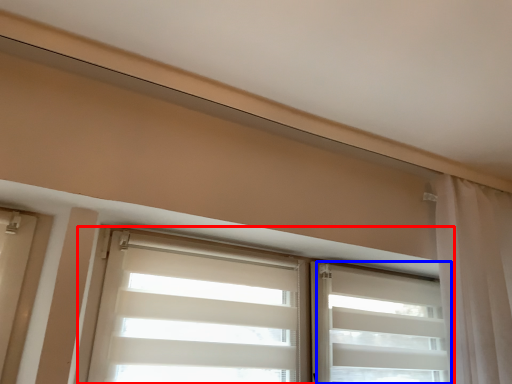
Question: Which of the following is the closest to the observer, window (highlighted by a red box) or shutter (highlighted by a blue box)?

Choices:
 (A) window
 (B) shutter

Answer: (A)